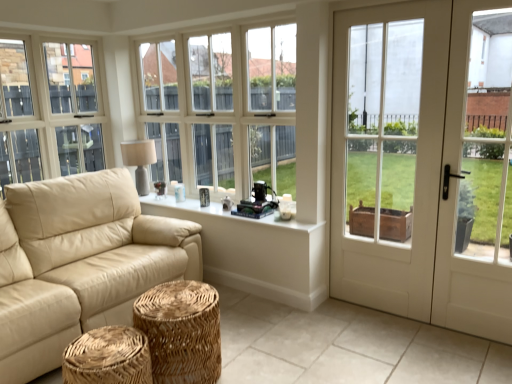
Question: Does white painted wood at center, acting as the second window sill starting from the bottom, appear on the right side of matte beige lampshade at upper left?

Choices:
 (A) no
 (B) yes

Answer: (B)

Question: Is white painted wood at center, acting as the second window sill starting from the bottom, wider than matte beige lampshade at upper left?

Choices:
 (A) yes
 (B) no

Answer: (B)

Question: Considering the relative sizes of white painted wood at center, acting as the 1th window sill starting from the top, and matte beige lampshade at upper left in the image provided, is white painted wood at center, acting as the 1th window sill starting from the top, taller than matte beige lampshade at upper left?

Choices:
 (A) no
 (B) yes

Answer: (A)

Question: Does white painted wood at center, acting as the second window sill starting from the bottom, come in front of matte beige lampshade at upper left?

Choices:
 (A) no
 (B) yes

Answer: (B)

Question: From a real-world perspective, is white painted wood at center, acting as the 1th window sill starting from the top, below matte beige lampshade at upper left?

Choices:
 (A) no
 (B) yes

Answer: (B)

Question: Is point coord(259,274) positioned closer to the camera than point coord(100,337)?

Choices:
 (A) closer
 (B) farther

Answer: (B)

Question: From the image's perspective, is white matte window sill at center, placed as the 1th window sill when sorted from bottom to top, above or below woven natural stool at lower center, the first stool viewed from the front?

Choices:
 (A) above
 (B) below

Answer: (A)

Question: In terms of height, does white matte window sill at center, acting as the 2th window sill starting from the top, look taller or shorter compared to woven natural stool at lower center, which ranks as the 2th stool in back-to-front order?

Choices:
 (A) tall
 (B) short

Answer: (A)

Question: Based on their sizes in the image, would you say white matte window sill at center, placed as the 1th window sill when sorted from bottom to top, is bigger or smaller than woven natural stool at lower center, which ranks as the 2th stool in back-to-front order?

Choices:
 (A) big
 (B) small

Answer: (B)

Question: Considering the positions of white painted wood at center, acting as the second window sill starting from the bottom, and woven natural stool at center, placed as the second stool when sorted from front to back, in the image, is white painted wood at center, acting as the second window sill starting from the bottom, wider or thinner than woven natural stool at center, placed as the second stool when sorted from front to back,?

Choices:
 (A) thin
 (B) wide

Answer: (A)

Question: From a real-world perspective, relative to woven natural stool at center, placed as the second stool when sorted from front to back, is white painted wood at center, acting as the second window sill starting from the bottom, vertically above or below?

Choices:
 (A) below
 (B) above

Answer: (B)

Question: Considering the relative positions of white painted wood at center, acting as the 1th window sill starting from the top, and woven natural stool at center, placed as the second stool when sorted from front to back, in the image provided, is white painted wood at center, acting as the 1th window sill starting from the top, to the left or to the right of woven natural stool at center, placed as the second stool when sorted from front to back,?

Choices:
 (A) left
 (B) right

Answer: (B)

Question: Is point (186, 200) positioned closer to the camera than point (215, 294)?

Choices:
 (A) farther
 (B) closer

Answer: (A)

Question: In the image, is white matte window sill at center, acting as the 2th window sill starting from the top, on the left side or the right side of matte beige lampshade at upper left?

Choices:
 (A) right
 (B) left

Answer: (A)

Question: Is white matte window sill at center, acting as the 2th window sill starting from the top, wider or thinner than matte beige lampshade at upper left?

Choices:
 (A) thin
 (B) wide

Answer: (A)